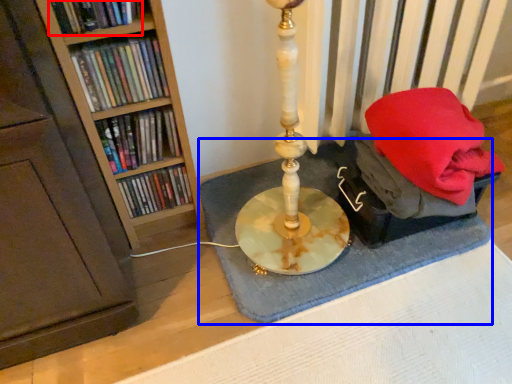
Question: Which point is further to the camera, book (highlighted by a red box) or bath mat (highlighted by a blue box)?

Choices:
 (A) book
 (B) bath mat

Answer: (B)